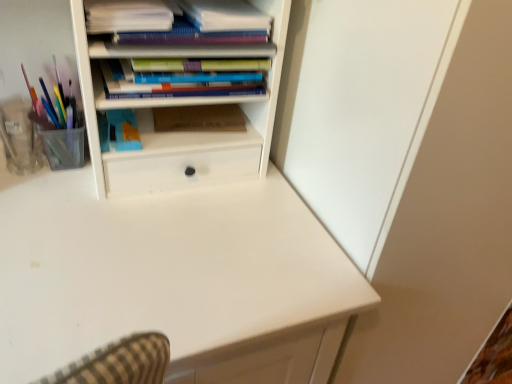
Question: Considering the relative sizes of brown cardboard at center, the 1th paperback book viewed from the right, and hardcover books at upper center, the third book from the top, in the image provided, is brown cardboard at center, the 1th paperback book viewed from the right, shorter than hardcover books at upper center, the third book from the top,?

Choices:
 (A) no
 (B) yes

Answer: (B)

Question: Is brown cardboard at center, placed as the 2th paperback book when sorted from left to right, closer to camera compared to hardcover books at upper center, the third book from the top?

Choices:
 (A) no
 (B) yes

Answer: (A)

Question: From a real-world perspective, is brown cardboard at center, placed as the 2th paperback book when sorted from left to right, physically above hardcover books at upper center, the first book positioned from the bottom?

Choices:
 (A) yes
 (B) no

Answer: (B)

Question: Is hardcover books at upper center, the first book positioned from the bottom, completely or partially inside brown cardboard at center, placed as the 2th paperback book when sorted from left to right?

Choices:
 (A) yes
 (B) no

Answer: (B)

Question: From the image's perspective, is brown cardboard at center, the 1th paperback book viewed from the right, below hardcover books at upper center, the first book positioned from the bottom?

Choices:
 (A) no
 (B) yes

Answer: (B)

Question: Does brown cardboard at center, the 1th paperback book viewed from the right, have a smaller size compared to hardcover books at upper center, the third book from the top?

Choices:
 (A) no
 (B) yes

Answer: (B)

Question: From a real-world perspective, is blue matte paperback book at center, the 1th paperback book viewed from the left, positioned over matte purple notebook at upper center, positioned as the 2th book in bottom-to-top order, based on gravity?

Choices:
 (A) no
 (B) yes

Answer: (A)

Question: Considering the relative positions of blue matte paperback book at center, placed as the 2th paperback book when sorted from right to left, and matte purple notebook at upper center, the 2th book positioned from the top, in the image provided, is blue matte paperback book at center, placed as the 2th paperback book when sorted from right to left, behind matte purple notebook at upper center, the 2th book positioned from the top,?

Choices:
 (A) yes
 (B) no

Answer: (A)

Question: Can you confirm if blue matte paperback book at center, placed as the 2th paperback book when sorted from right to left, is shorter than matte purple notebook at upper center, positioned as the 2th book in bottom-to-top order?

Choices:
 (A) no
 (B) yes

Answer: (A)

Question: Is matte purple notebook at upper center, the 2th book positioned from the top, located within blue matte paperback book at center, placed as the 2th paperback book when sorted from right to left?

Choices:
 (A) yes
 (B) no

Answer: (B)

Question: Can we say blue matte paperback book at center, the 1th paperback book viewed from the left, lies outside matte purple notebook at upper center, the 2th book positioned from the top?

Choices:
 (A) no
 (B) yes

Answer: (B)

Question: Is blue matte paperback book at center, placed as the 2th paperback book when sorted from right to left, facing towards matte purple notebook at upper center, positioned as the 2th book in bottom-to-top order?

Choices:
 (A) yes
 (B) no

Answer: (B)

Question: Is the position of matte purple notebook at upper center, positioned as the 2th book in bottom-to-top order, less distant than that of blue matte paperback book at center, the 1th paperback book viewed from the left?

Choices:
 (A) yes
 (B) no

Answer: (A)